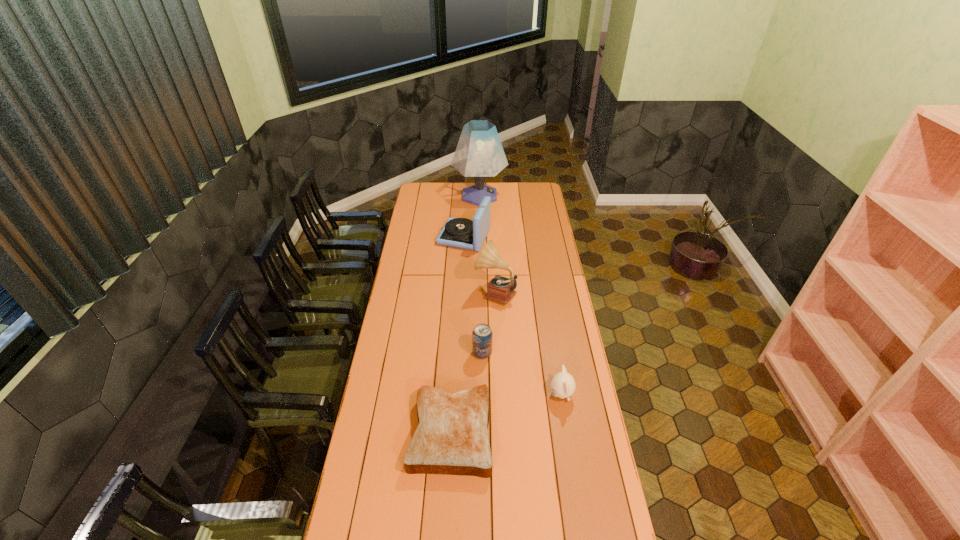
Find the location of `vacant space located 0.180m on the base of the lampshade`. vacant space located 0.180m on the base of the lampshade is located at coordinates (535, 196).

Identify the location of free space located on the horn of the taller phonograph record. The width and height of the screenshot is (960, 540). (430, 292).

At what (x,y) coordinates should I click in order to perform the action: click on blank space located 0.400m on the horn of the taller phonograph record. Please return your answer as a coordinate pair (x, y). The width and height of the screenshot is (960, 540). Looking at the image, I should click on (394, 292).

Find the location of a particular element. The width and height of the screenshot is (960, 540). free space located on the horn of the taller phonograph record is located at coordinates (421, 292).

The image size is (960, 540). Find the location of `free spot located 0.090m on the right of the farther phonograph record`. free spot located 0.090m on the right of the farther phonograph record is located at coordinates (506, 237).

Identify the location of vacant space situated on the back of the pop soda. (482, 325).

The width and height of the screenshot is (960, 540). I want to click on vacant area situated on the face of the kitten, so click(x=521, y=395).

Find the location of a particular element. The height and width of the screenshot is (540, 960). vacant space situated 0.360m on the face of the kitten is located at coordinates (457, 395).

This screenshot has width=960, height=540. Identify the location of free point located on the face of the kitten. (449, 395).

This screenshot has height=540, width=960. I want to click on vacant region located on the left of the shortest object, so click(x=370, y=433).